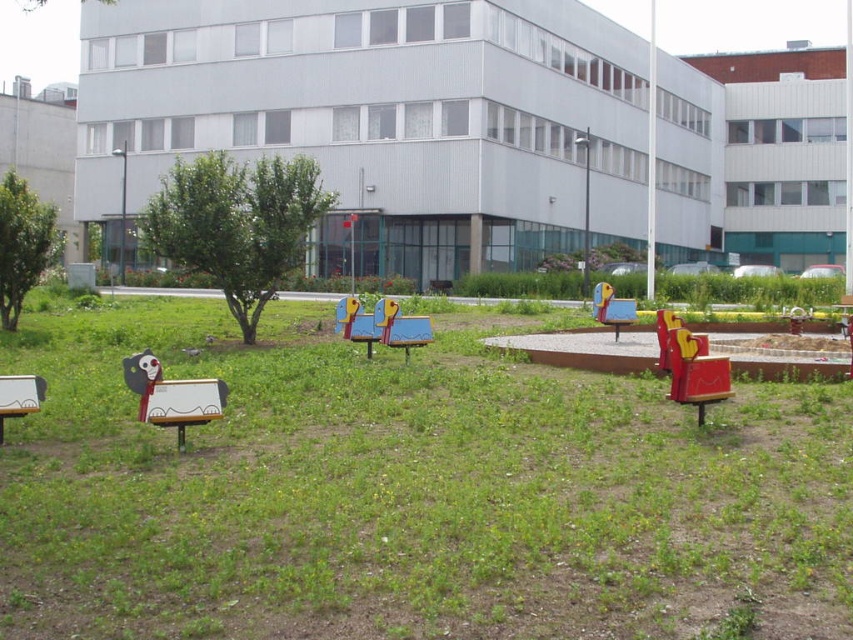
Question: Is wooden painted bench at lower left positioned behind matte white bench at lower left?

Choices:
 (A) yes
 (B) no

Answer: (B)

Question: Which object is positioned farthest from the wooden painted bench at center right?

Choices:
 (A) wooden painted bench at center
 (B) matte white bench at lower left
 (C) wooden bench at lower left

Answer: (B)

Question: Which point is closer to the camera?

Choices:
 (A) wooden painted bench at center
 (B) wooden painted bench at center right
 (C) matte white bench at lower left
 (D) wooden painted bench at lower left

Answer: (D)

Question: Is wooden painted bench at lower left to the left of wooden painted bench at center from the viewer's perspective?

Choices:
 (A) no
 (B) yes

Answer: (B)

Question: Which of the following is the farthest from the observer?

Choices:
 (A) wooden painted bench at center right
 (B) wooden painted bench at lower left
 (C) matte white bench at lower left

Answer: (C)

Question: Can you confirm if wooden painted bench at center is bigger than matte white bench at lower left?

Choices:
 (A) yes
 (B) no

Answer: (A)